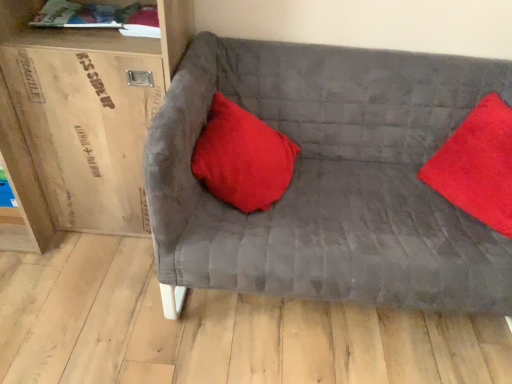
Question: Considering the relative sizes of wooden cardboard box at left and satin red pillow at center, positioned as the first pillow in left-to-right order, in the image provided, is wooden cardboard box at left bigger than satin red pillow at center, positioned as the first pillow in left-to-right order,?

Choices:
 (A) yes
 (B) no

Answer: (A)

Question: Considering the relative sizes of wooden cardboard box at left and satin red pillow at center, positioned as the first pillow in left-to-right order, in the image provided, is wooden cardboard box at left thinner than satin red pillow at center, positioned as the first pillow in left-to-right order,?

Choices:
 (A) no
 (B) yes

Answer: (A)

Question: Is the depth of wooden cardboard box at left less than that of satin red pillow at center, positioned as the first pillow in left-to-right order?

Choices:
 (A) yes
 (B) no

Answer: (A)

Question: Is wooden cardboard box at left positioned with its back to satin red pillow at center, the second pillow positioned from the right?

Choices:
 (A) yes
 (B) no

Answer: (B)

Question: From a real-world perspective, is wooden cardboard box at left on satin red pillow at center, the second pillow positioned from the right?

Choices:
 (A) yes
 (B) no

Answer: (A)

Question: Based on their sizes in the image, would you say hardcover book at upper left is bigger or smaller than velvet gray couch at center?

Choices:
 (A) big
 (B) small

Answer: (B)

Question: Choose the correct answer: Is hardcover book at upper left inside velvet gray couch at center or outside it?

Choices:
 (A) outside
 (B) inside

Answer: (A)

Question: Considering their positions, is hardcover book at upper left located in front of or behind velvet gray couch at center?

Choices:
 (A) front
 (B) behind

Answer: (B)

Question: Based on their positions, is hardcover book at upper left located to the left or right of velvet gray couch at center?

Choices:
 (A) left
 (B) right

Answer: (A)

Question: Based on their sizes in the image, would you say satin red pillow at center, the second pillow positioned from the right, is bigger or smaller than wooden cardboard box at left?

Choices:
 (A) big
 (B) small

Answer: (B)

Question: In terms of width, does satin red pillow at center, positioned as the first pillow in left-to-right order, look wider or thinner when compared to wooden cardboard box at left?

Choices:
 (A) thin
 (B) wide

Answer: (A)

Question: Relative to wooden cardboard box at left, is satin red pillow at center, the second pillow positioned from the right, in front or behind?

Choices:
 (A) front
 (B) behind

Answer: (B)

Question: Is satin red pillow at center, positioned as the first pillow in left-to-right order, inside or outside of wooden cardboard box at left?

Choices:
 (A) outside
 (B) inside

Answer: (A)

Question: Visually, is satin red pillow at center, positioned as the first pillow in left-to-right order, positioned to the left or to the right of hardcover book at upper left?

Choices:
 (A) right
 (B) left

Answer: (A)

Question: From the image's perspective, is satin red pillow at center, the second pillow positioned from the right, positioned above or below hardcover book at upper left?

Choices:
 (A) above
 (B) below

Answer: (B)